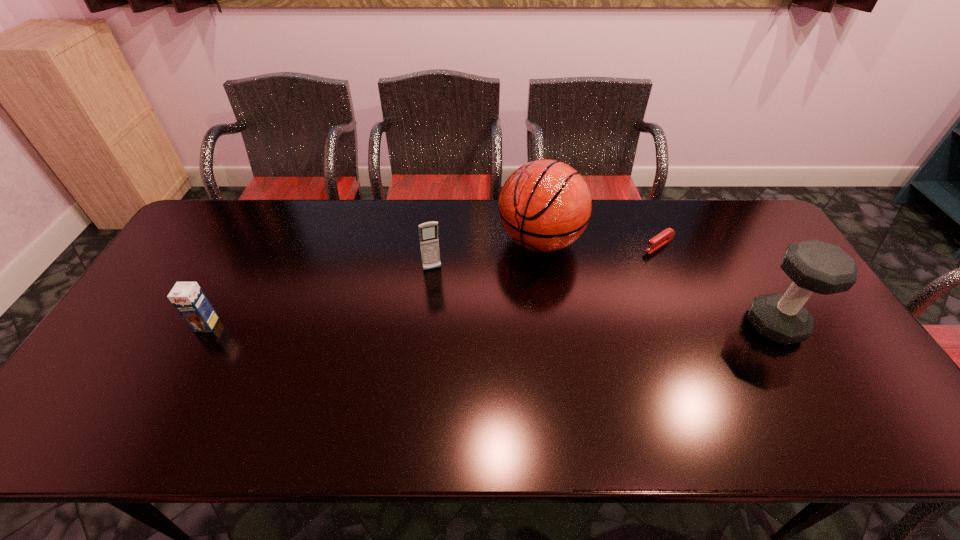
Find the location of `the leftmost object`. the leftmost object is located at coordinates (188, 298).

Locate an element on the screen. the second shortest object is located at coordinates (188, 298).

Find the location of a particular element. The width and height of the screenshot is (960, 540). the rightmost object is located at coordinates (814, 266).

Identify the location of the third object from right to left. Image resolution: width=960 pixels, height=540 pixels. (545, 205).

Locate an element on the screen. the fourth object from left to right is located at coordinates (665, 236).

Identify the location of stapler. (665, 236).

In order to click on cellular telephone in this screenshot , I will do `click(428, 232)`.

Locate an element on the screen. the third shortest object is located at coordinates (428, 232).

Where is `blank space located on the front label of the leftmost object`? This screenshot has height=540, width=960. blank space located on the front label of the leftmost object is located at coordinates (183, 368).

Where is `vacant area located 0.080m on the right of the rightmost object`? vacant area located 0.080m on the right of the rightmost object is located at coordinates (832, 325).